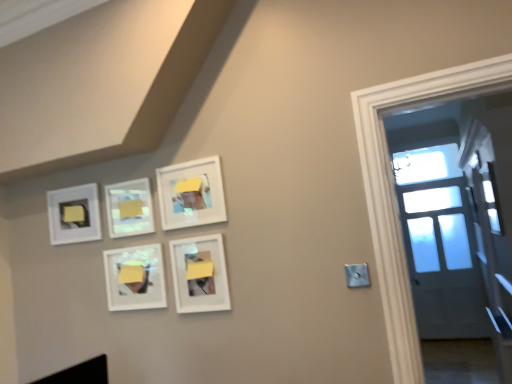
Question: Considering the relative sizes of yellow matte paper at upper center, positioned as the first lift in front-to-back order, and white matte picture frame at lower center, which is the 5th picture frame from left to right, in the image provided, is yellow matte paper at upper center, positioned as the first lift in front-to-back order, bigger than white matte picture frame at lower center, which is the 5th picture frame from left to right,?

Choices:
 (A) no
 (B) yes

Answer: (A)

Question: Considering the relative positions of yellow matte paper at upper center, which appears as the first lift when viewed from the right, and white matte picture frame at lower center, which is the 5th picture frame from left to right, in the image provided, is yellow matte paper at upper center, which appears as the first lift when viewed from the right, to the left of white matte picture frame at lower center, which is the 5th picture frame from left to right, from the viewer's perspective?

Choices:
 (A) yes
 (B) no

Answer: (A)

Question: Is white matte picture frame at lower center, which is the 5th picture frame from left to right, completely or partially inside yellow matte paper at upper center, which ranks as the 2th lift in left-to-right order?

Choices:
 (A) no
 (B) yes

Answer: (A)

Question: Is yellow matte paper at upper center, the 2th lift viewed from the back, at the right side of white matte picture frame at lower center, which is the 5th picture frame from left to right?

Choices:
 (A) yes
 (B) no

Answer: (B)

Question: Is yellow matte paper at upper center, positioned as the first lift in front-to-back order, not within white matte picture frame at lower center, the 1th picture frame when ordered from right to left?

Choices:
 (A) no
 (B) yes

Answer: (B)

Question: Considering the positions of yellow matte paper at upper center, positioned as the first lift in front-to-back order, and matte white picture frame at upper center, the fourth picture frame from the left, in the image, is yellow matte paper at upper center, positioned as the first lift in front-to-back order, taller or shorter than matte white picture frame at upper center, the fourth picture frame from the left,?

Choices:
 (A) tall
 (B) short

Answer: (B)

Question: Considering the positions of yellow matte paper at upper center, which appears as the first lift when viewed from the right, and matte white picture frame at upper center, the 2th picture frame from the right, in the image, is yellow matte paper at upper center, which appears as the first lift when viewed from the right, bigger or smaller than matte white picture frame at upper center, the 2th picture frame from the right,?

Choices:
 (A) big
 (B) small

Answer: (B)

Question: From the image's perspective, is yellow matte paper at upper center, which ranks as the 2th lift in left-to-right order, positioned above or below matte white picture frame at upper center, the fourth picture frame from the left?

Choices:
 (A) above
 (B) below

Answer: (B)

Question: Is yellow matte paper at upper center, which appears as the first lift when viewed from the right, wider or thinner than matte white picture frame at upper center, the fourth picture frame from the left?

Choices:
 (A) thin
 (B) wide

Answer: (A)

Question: Based on their positions, is yellow matte paper at upper left, which appears as the first lift when viewed from the back, located to the left or right of yellow matte paper at upper center, positioned as the first lift in front-to-back order?

Choices:
 (A) left
 (B) right

Answer: (A)

Question: From a real-world perspective, is yellow matte paper at upper left, which is the second lift from front to back, above or below yellow matte paper at upper center, which ranks as the 2th lift in left-to-right order?

Choices:
 (A) above
 (B) below

Answer: (A)

Question: Considering the positions of yellow matte paper at upper left, which appears as the 1th lift when viewed from the left, and yellow matte paper at upper center, which appears as the first lift when viewed from the right, in the image, is yellow matte paper at upper left, which appears as the 1th lift when viewed from the left, bigger or smaller than yellow matte paper at upper center, which appears as the first lift when viewed from the right,?

Choices:
 (A) big
 (B) small

Answer: (A)

Question: In the image, is yellow matte paper at upper left, arranged as the second lift when viewed from the right, positioned in front of or behind yellow matte paper at upper center, positioned as the first lift in front-to-back order?

Choices:
 (A) front
 (B) behind

Answer: (B)

Question: Is point pyautogui.click(x=75, y=216) closer or farther from the camera than point pyautogui.click(x=141, y=231)?

Choices:
 (A) closer
 (B) farther

Answer: (B)

Question: Is yellow matte paper at upper left, arranged as the second lift when viewed from the right, taller or shorter than matte white picture frame at upper center, positioned as the 4th picture frame in right-to-left order?

Choices:
 (A) short
 (B) tall

Answer: (A)